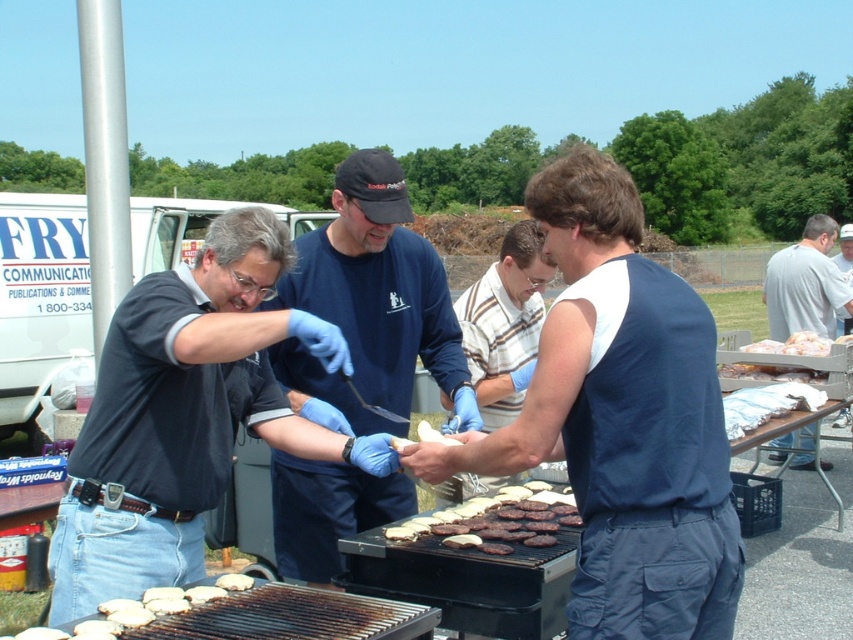
Who is shorter, dark blue shirt at center or gray cotton shirt at right?

dark blue shirt at center is shorter.

Is dark blue shirt at center in front of gray cotton shirt at right?

Yes, it is in front of gray cotton shirt at right.

Describe the element at coordinates (186, 416) in the screenshot. This screenshot has width=853, height=640. I see `dark blue shirt at center` at that location.

At what (x,y) coordinates should I click in order to perform the action: click on dark blue shirt at center. Please return your answer as a coordinate pair (x, y). The image size is (853, 640). Looking at the image, I should click on (186, 416).

Can you confirm if dark blue shirt at center is shorter than blue cotton shirt at center?

Indeed, dark blue shirt at center has a lesser height compared to blue cotton shirt at center.

Which is more to the left, dark blue shirt at center or blue cotton shirt at center?

From the viewer's perspective, dark blue shirt at center appears more on the left side.

Between point (273, 312) and point (434, 272), which one is positioned behind?

Point (434, 272)

At what (x,y) coordinates should I click in order to perform the action: click on dark blue shirt at center. Please return your answer as a coordinate pair (x, y). The image size is (853, 640). Looking at the image, I should click on (186, 416).

The image size is (853, 640). Describe the element at coordinates (503, 323) in the screenshot. I see `white striped shirt at center` at that location.

Is white striped shirt at center thinner than brown matte hamburger patties at center?

Yes, white striped shirt at center is thinner than brown matte hamburger patties at center.

The height and width of the screenshot is (640, 853). What do you see at coordinates (503, 323) in the screenshot? I see `white striped shirt at center` at bounding box center [503, 323].

Image resolution: width=853 pixels, height=640 pixels. I want to click on white striped shirt at center, so click(503, 323).